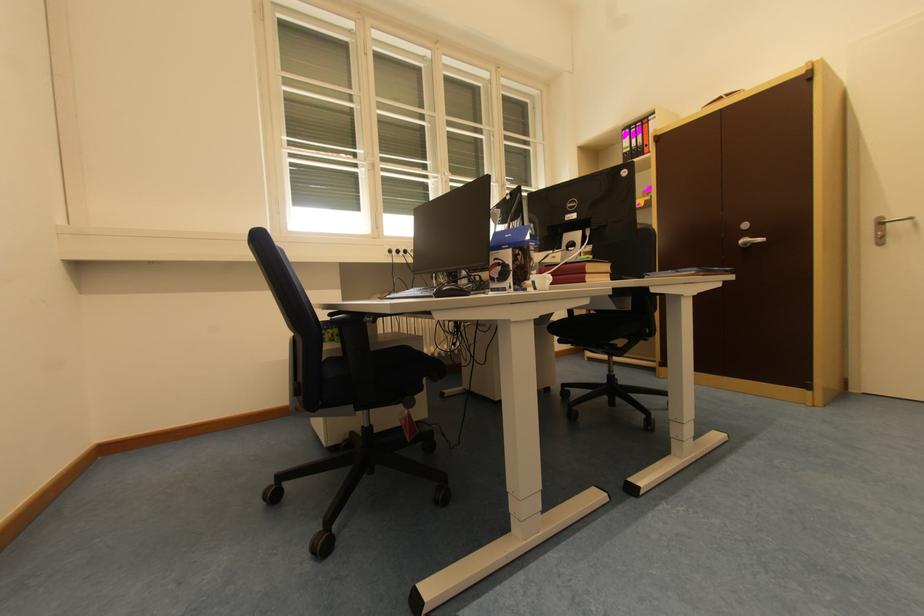
The height and width of the screenshot is (616, 924). What do you see at coordinates (342, 329) in the screenshot? I see `a black chair armrest` at bounding box center [342, 329].